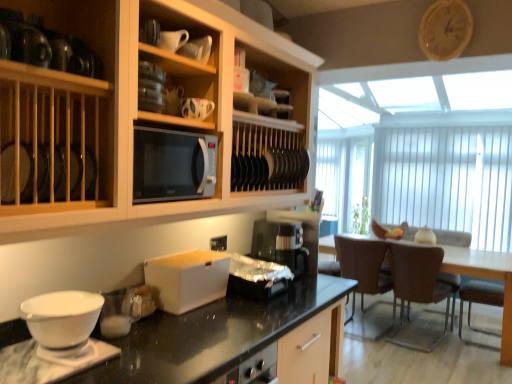
Question: From the image's perspective, would you say white matte bowl at lower left is positioned over brown leather armchair at right, which ranks as the second armchair in front-to-back order?

Choices:
 (A) no
 (B) yes

Answer: (B)

Question: Considering the relative positions of white matte bowl at lower left and brown leather armchair at right, positioned as the 1th armchair in back-to-front order, in the image provided, is white matte bowl at lower left to the left of brown leather armchair at right, positioned as the 1th armchair in back-to-front order, from the viewer's perspective?

Choices:
 (A) no
 (B) yes

Answer: (B)

Question: Does white matte bowl at lower left have a smaller size compared to brown leather armchair at right, which ranks as the second armchair in front-to-back order?

Choices:
 (A) yes
 (B) no

Answer: (A)

Question: Can you confirm if white matte bowl at lower left is bigger than brown leather armchair at right, which ranks as the second armchair in front-to-back order?

Choices:
 (A) no
 (B) yes

Answer: (A)

Question: Is white matte bowl at lower left completely or partially outside of brown leather armchair at right, positioned as the 1th armchair in back-to-front order?

Choices:
 (A) no
 (B) yes

Answer: (B)

Question: Is brown leather chair at right, which appears as the 1th chair when viewed from the right, inside or outside of brown leather armchair at right, positioned as the 1th armchair in back-to-front order?

Choices:
 (A) inside
 (B) outside

Answer: (B)

Question: Is point (417, 284) positioned closer to the camera than point (468, 243)?

Choices:
 (A) farther
 (B) closer

Answer: (B)

Question: From the image's perspective, is brown leather chair at right, which appears as the 1th chair when viewed from the right, located above or below brown leather armchair at right, positioned as the 1th armchair in back-to-front order?

Choices:
 (A) below
 (B) above

Answer: (A)

Question: From a real-world perspective, relative to brown leather armchair at right, positioned as the 1th armchair in back-to-front order, is brown leather chair at right, which appears as the 1th chair when viewed from the right, vertically above or below?

Choices:
 (A) below
 (B) above

Answer: (A)

Question: Is matte ceramic mug at upper center, the second tableware positioned from the back, inside the boundaries of shiny metallic container at center, or outside?

Choices:
 (A) inside
 (B) outside

Answer: (B)

Question: Is matte ceramic mug at upper center, positioned as the 1th tableware in top-to-bottom order, in front of or behind shiny metallic container at center in the image?

Choices:
 (A) front
 (B) behind

Answer: (A)

Question: From a real-world perspective, is matte ceramic mug at upper center, which is counted as the 1th tableware, starting from the front, positioned above or below shiny metallic container at center?

Choices:
 (A) below
 (B) above

Answer: (B)

Question: Looking at their shapes, would you say matte ceramic mug at upper center, the second tableware positioned from the back, is wider or thinner than shiny metallic container at center?

Choices:
 (A) wide
 (B) thin

Answer: (B)

Question: From their relative heights in the image, would you say matte ceramic mug at upper center, the second tableware when ordered from top to bottom, is taller or shorter than brown leather chair at right, which appears as the 1th chair when viewed from the right?

Choices:
 (A) tall
 (B) short

Answer: (B)

Question: Is matte ceramic mug at upper center, the second tableware when ordered from top to bottom, situated inside brown leather chair at right, placed as the second chair when sorted from left to right, or outside?

Choices:
 (A) outside
 (B) inside

Answer: (A)